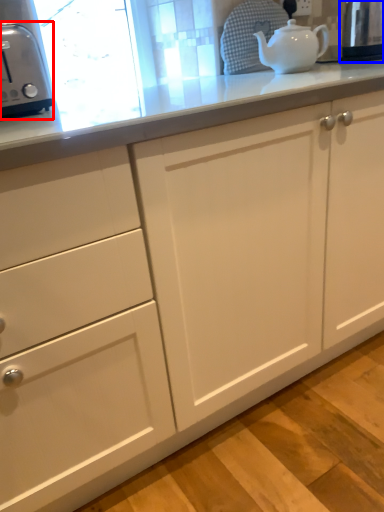
Question: Among these objects, which one is farthest to the camera, toaster (highlighted by a red box) or appliance (highlighted by a blue box)?

Choices:
 (A) toaster
 (B) appliance

Answer: (B)